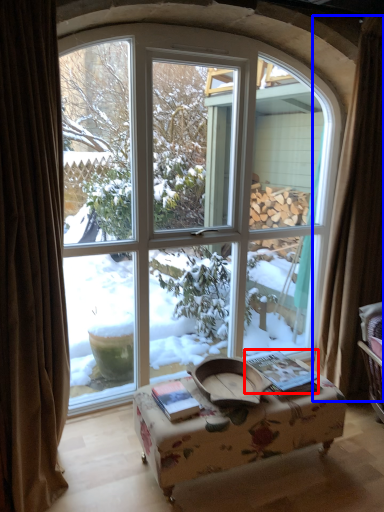
Question: Among these objects, which one is farthest to the camera, book (highlighted by a red box) or curtain (highlighted by a blue box)?

Choices:
 (A) book
 (B) curtain

Answer: (B)